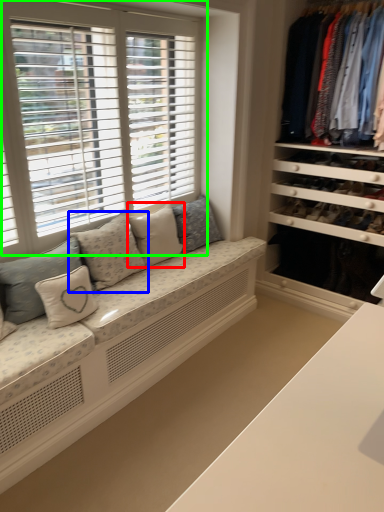
Question: Considering the real-world distances, which object is farthest from pillow (highlighted by a red box)? pillow (highlighted by a blue box) or window (highlighted by a green box)?

Choices:
 (A) pillow
 (B) window

Answer: (B)